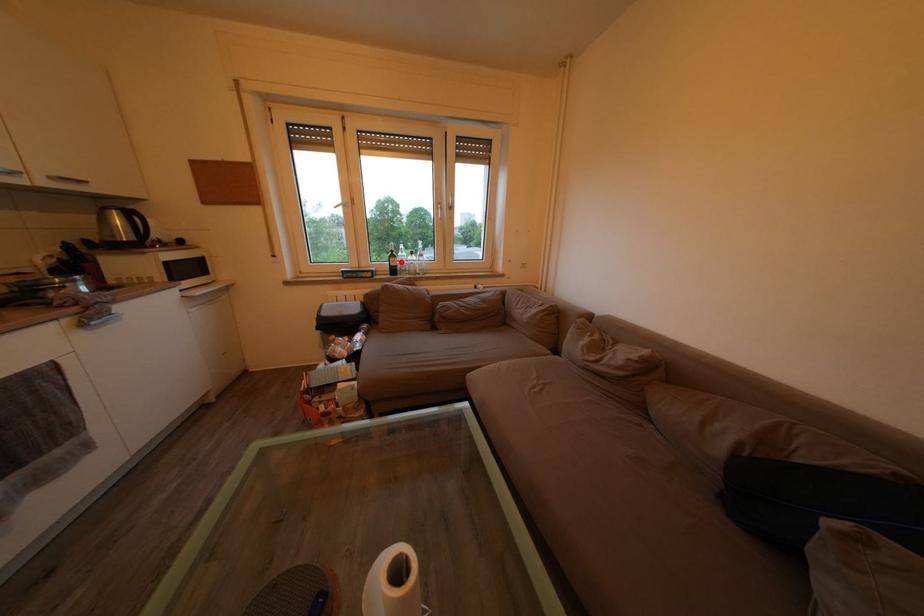
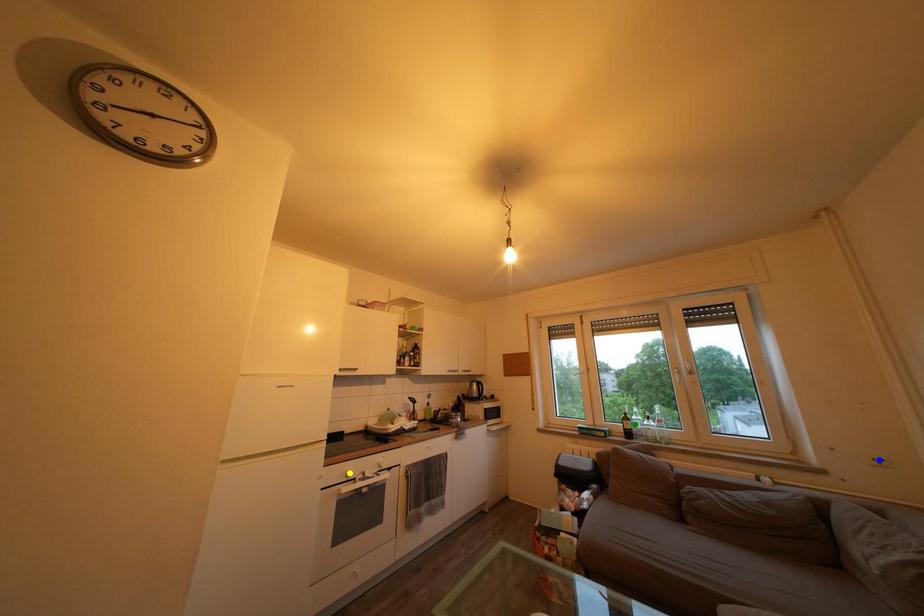
Question: I am providing you with two images of the same scene from different viewpoints. A red point is marked on the first image. You are given multiple points on the second image. In image 2, which mark is for the same physical point as the one in image 1?

Choices:
 (A) blue point
 (B) yellow point
 (C) green point

Answer: (C)